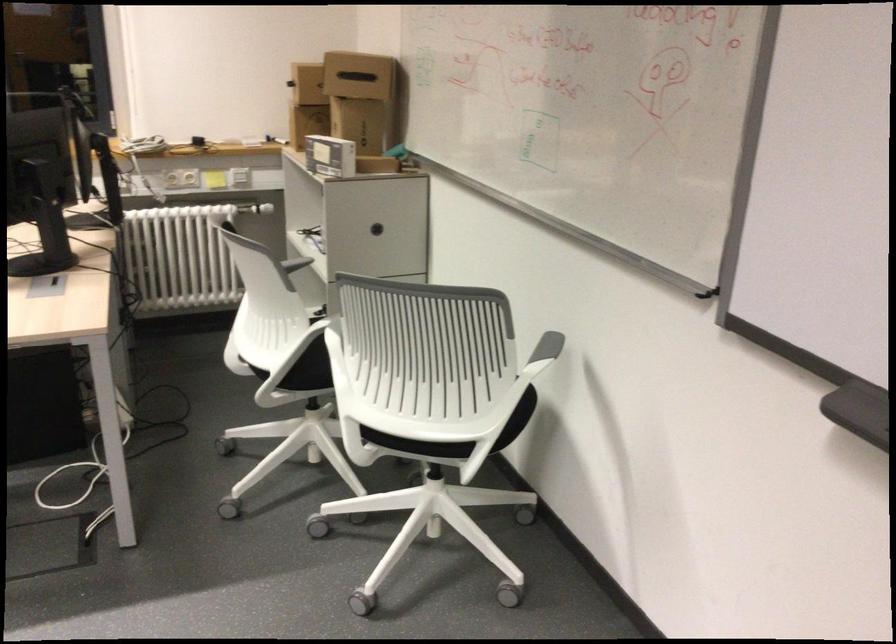
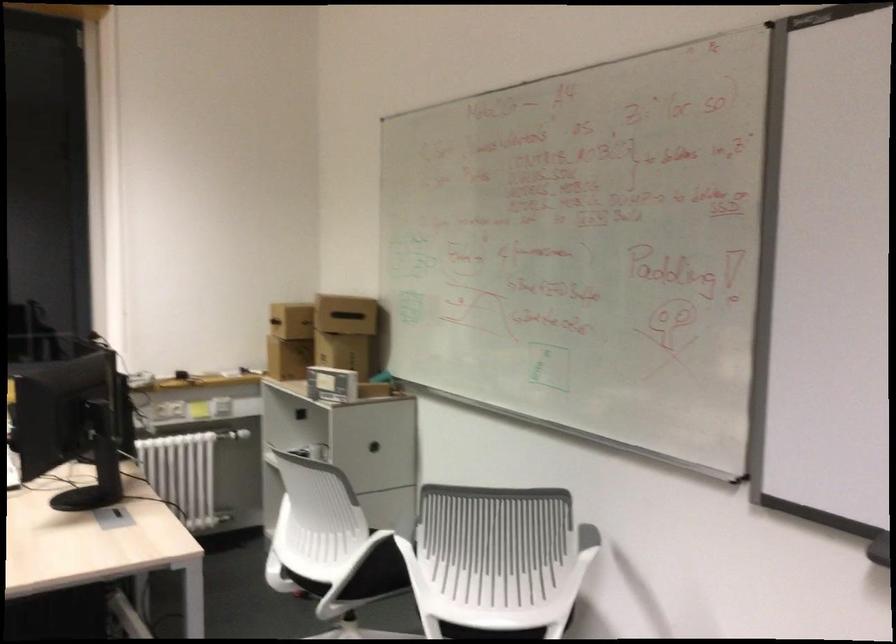
Question: Based on the continuous images, in which direction is the camera rotating? Reply with the corresponding letter.

Choices:
 (A) Left
 (B) Right
 (C) Up
 (D) Down

Answer: (C)